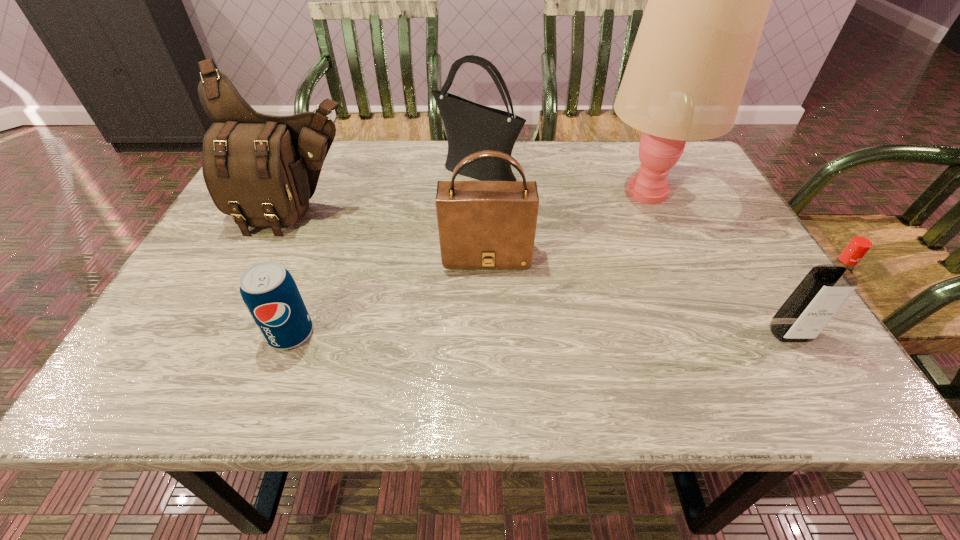
This screenshot has height=540, width=960. I want to click on vacant space positioned 0.180m on the front flap of the shortest shoulder bag, so click(x=488, y=341).

This screenshot has width=960, height=540. In order to click on blank space located on the front and back of the vodka in this screenshot , I will do `click(816, 378)`.

This screenshot has height=540, width=960. In order to click on free point located on the right of the pop in this screenshot , I will do `click(464, 334)`.

The width and height of the screenshot is (960, 540). What are the coordinates of `lampshade that is positioned at the far edge` in the screenshot? It's located at (708, 0).

This screenshot has height=540, width=960. I want to click on shoulder bag that is at the far edge, so click(470, 127).

This screenshot has width=960, height=540. I want to click on object at the left edge, so click(260, 169).

Find the location of a particular element. This screenshot has width=960, height=540. lampshade that is at the right edge is located at coordinates (708, 0).

This screenshot has width=960, height=540. Find the location of `vodka that is at the right edge`. vodka that is at the right edge is located at coordinates (823, 291).

Identify the location of object that is at the far right corner. (708, 0).

You are a GUI agent. You are given a task and a screenshot of the screen. Output one action in this format:
    pyautogui.click(x=<x>, y=<y>)
    Task: Click on the vacant region at the far edge of the desktop
    Image resolution: width=960 pixels, height=540 pixels.
    Given the screenshot: What is the action you would take?
    pyautogui.click(x=552, y=143)